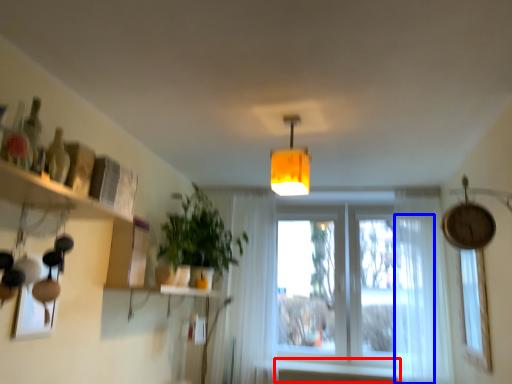
Question: Which point is further to the camera, window sill (highlighted by a red box) or curtain (highlighted by a blue box)?

Choices:
 (A) window sill
 (B) curtain

Answer: (A)